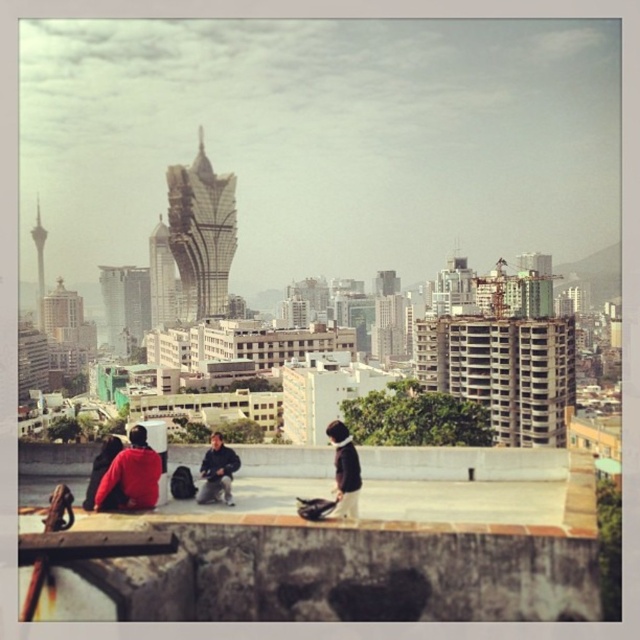
Question: Does silver metallic tower at center have a greater width compared to red matte jacket at lower left?

Choices:
 (A) no
 (B) yes

Answer: (B)

Question: Which point is farther from the camera taking this photo?

Choices:
 (A) (160, 225)
 (B) (116, 452)
 (C) (198, 497)
 (D) (198, 316)

Answer: (A)

Question: Is silver metallic tower at center thinner than shiny glass tower at center?

Choices:
 (A) no
 (B) yes

Answer: (A)

Question: Which point appears closest to the camera in this image?

Choices:
 (A) (204, 454)
 (B) (152, 301)

Answer: (A)

Question: Which point is farther to the camera?

Choices:
 (A) shiny glass tower at center
 (B) dark blue jeans at center
 (C) silver metallic tower at center
 (D) red matte jacket at lower left

Answer: (A)

Question: Does shiny glass tower at center have a lesser width compared to dark blue jeans at center?

Choices:
 (A) yes
 (B) no

Answer: (A)